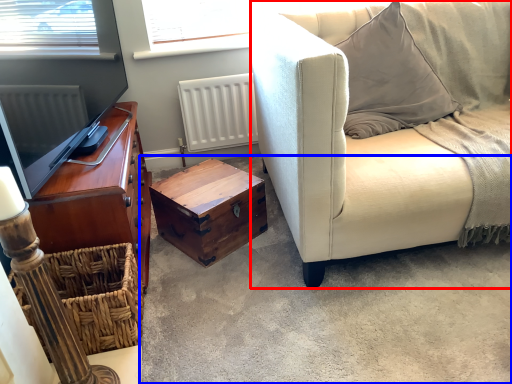
Question: Which object appears closest to the camera in this image, studio couch (highlighted by a red box) or concrete (highlighted by a blue box)?

Choices:
 (A) studio couch
 (B) concrete

Answer: (B)